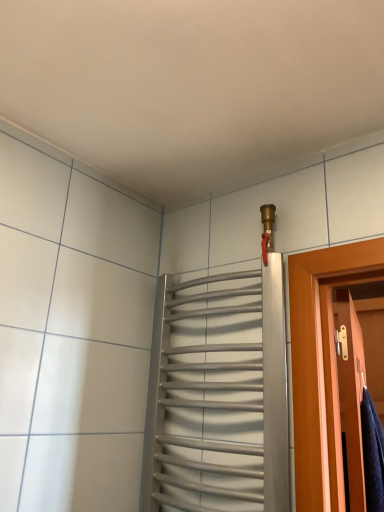
The width and height of the screenshot is (384, 512). Describe the element at coordinates (218, 395) in the screenshot. I see `silver metallic towel rack at upper center` at that location.

Identify the location of silver metallic towel rack at upper center. tap(218, 395).

The width and height of the screenshot is (384, 512). I want to click on wooden door at right, so click(321, 365).

The width and height of the screenshot is (384, 512). What do you see at coordinates (321, 365) in the screenshot?
I see `wooden door at right` at bounding box center [321, 365].

In order to face wooden door at right, should I rotate leftwards or rightwards?

To face it directly, rotate right by 20.609 degrees.

Where is `silver metallic towel rack at upper center`? The image size is (384, 512). silver metallic towel rack at upper center is located at coordinates (218, 395).

Visually, is silver metallic towel rack at upper center positioned to the left or to the right of wooden door at right?

In the image, silver metallic towel rack at upper center appears on the left side of wooden door at right.

Who is more distant, silver metallic towel rack at upper center or wooden door at right?

wooden door at right is behind.

Does point (164, 292) come closer to viewer compared to point (324, 346)?

No, (164, 292) is behind (324, 346).

From the image's perspective, between silver metallic towel rack at upper center and wooden door at right, who is located below?

From the image's view, wooden door at right is below.

From a real-world perspective, is silver metallic towel rack at upper center above or below wooden door at right?

silver metallic towel rack at upper center is above wooden door at right.

Which of these two, silver metallic towel rack at upper center or wooden door at right, is thinner?

wooden door at right is thinner.

From their relative heights in the image, would you say silver metallic towel rack at upper center is taller or shorter than wooden door at right?

In the image, silver metallic towel rack at upper center appears to be taller than wooden door at right.

Considering the sizes of objects silver metallic towel rack at upper center and wooden door at right in the image provided, who is smaller, silver metallic towel rack at upper center or wooden door at right?

silver metallic towel rack at upper center.

Is silver metallic towel rack at upper center not inside wooden door at right?

Indeed, silver metallic towel rack at upper center is completely outside wooden door at right.

Are silver metallic towel rack at upper center and wooden door at right far apart?

No, silver metallic towel rack at upper center is not far from wooden door at right.

Could you tell me if silver metallic towel rack at upper center is turned towards wooden door at right?

No, silver metallic towel rack at upper center is not aimed at wooden door at right.

Locate an element on the screen. The width and height of the screenshot is (384, 512). door that appears below the silver metallic towel rack at upper center (from the image's perspective) is located at coordinates 321,365.

Does wooden door at right appear on the left side of silver metallic towel rack at upper center?

No.

Looking at this image, who is more distant, wooden door at right or silver metallic towel rack at upper center?

Positioned behind is wooden door at right.

Which is farther from the camera, (x=322, y=251) or (x=209, y=290)?

The point (x=209, y=290) is more distant.

From the image's perspective, is wooden door at right beneath silver metallic towel rack at upper center?

Yes, from the image's perspective, wooden door at right is below silver metallic towel rack at upper center.

From a real-world perspective, is wooden door at right on silver metallic towel rack at upper center?

Actually, wooden door at right is physically below silver metallic towel rack at upper center in the real world.

In the scene shown: Which object is thinner, wooden door at right or silver metallic towel rack at upper center?

Thinner between the two is wooden door at right.

Considering the sizes of objects wooden door at right and silver metallic towel rack at upper center in the image provided, who is shorter, wooden door at right or silver metallic towel rack at upper center?

wooden door at right.

From the picture: Considering the relative sizes of wooden door at right and silver metallic towel rack at upper center in the image provided, is wooden door at right bigger than silver metallic towel rack at upper center?

Yes, wooden door at right is bigger than silver metallic towel rack at upper center.

Is wooden door at right inside or outside of silver metallic towel rack at upper center?

wooden door at right lies outside silver metallic towel rack at upper center.

Is wooden door at right far from silver metallic towel rack at upper center?

No, there isn't a large distance between wooden door at right and silver metallic towel rack at upper center.

Is wooden door at right positioned with its back to silver metallic towel rack at upper center?

Absolutely, wooden door at right is directed away from silver metallic towel rack at upper center.

Identify the location of elevator on the left of wooden door at right. The width and height of the screenshot is (384, 512). (218, 395).

What are the coordinates of `elevator that is in front of the wooden door at right` in the screenshot? It's located at (218, 395).

Find the location of a particular element. The height and width of the screenshot is (512, 384). door that appears behind the silver metallic towel rack at upper center is located at coordinates (321, 365).